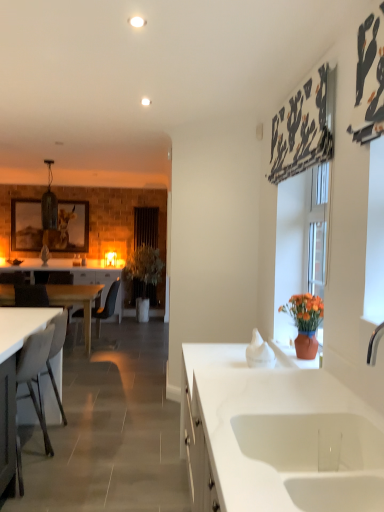
Question: Visually, is white matte desk at lower left, placed as the 2th desk when sorted from left to right, positioned to the left or to the right of white wood desk at left, positioned as the first desk in left-to-right order?

Choices:
 (A) right
 (B) left

Answer: (A)

Question: Does point (8, 398) appear closer or farther from the camera than point (87, 337)?

Choices:
 (A) farther
 (B) closer

Answer: (B)

Question: Based on their relative distances, which object is nearer to the green leafy plant at center?

Choices:
 (A) white glossy countertop at lower left
 (B) wooden framed picture at left
 (C) white matte chair at left, which is the 2th armchair in back-to-front order
 (D) white wood desk at left, placed as the 2th desk when sorted from right to left
 (E) brown leather armchair at left, which appears as the second armchair when viewed from the front

Answer: (B)

Question: Estimate the real-world distances between objects in this image. Which object is farther from the white matte chair at left, which is the 2th armchair in back-to-front order?

Choices:
 (A) white wood desk at left, placed as the 2th desk when sorted from right to left
 (B) black fabric curtain at center
 (C) white glossy countertop at lower left
 (D) green leafy plant at center
 (E) white matte desk at lower left, acting as the second desk starting from the back

Answer: (E)